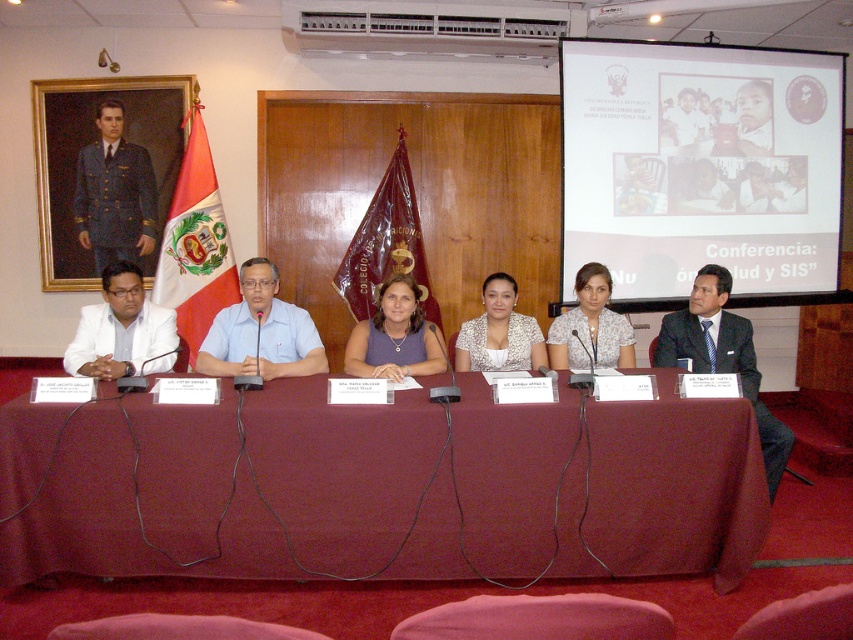
What object is located at the coordinates point (386, 243) in the image?

The point (386, 243) corresponds to the maroon fabric flag at center.

Please describe the position of the white matte suit at left in terms of coordinates within the image frame. The image frame has its origin at the bottom left corner with x increasing to the right and y increasing upward.

The white matte suit at left is located at coordinates x 0.516 and y 0.143 within the image frame.

You are organizing a photo shoot and need to ensure that the maroon fabric flag at center and the white matte suit at left are visible in the frame. Given that the camera has a fixed focal length, which object should you prioritize positioning closer to the lens to ensure clarity?

The white matte suit at left should be positioned closer to the lens because it is smaller in width compared to the maroon fabric flag at center, ensuring both objects are clearly visible within the frame.